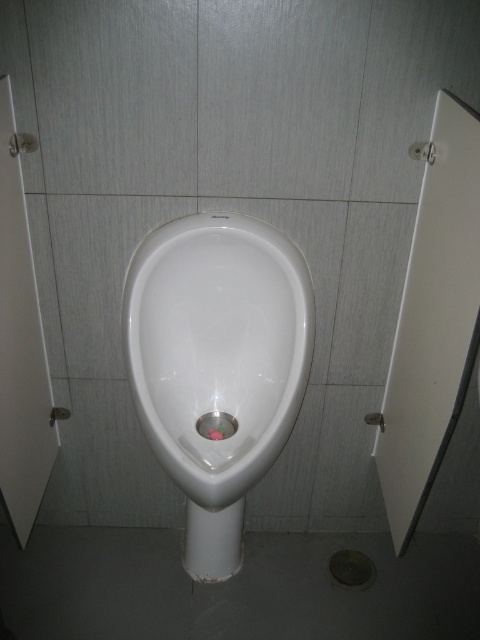
Who is more forward, (162, 326) or (352, 556)?

Positioned in front is point (162, 326).

Who is positioned more to the right, white glossy urinal at center or matte metallic drain at lower center?

Positioned to the right is matte metallic drain at lower center.

Does point (190, 282) come closer to viewer compared to point (348, 582)?

Yes.

Locate an element on the screen. The height and width of the screenshot is (640, 480). white glossy urinal at center is located at coordinates (217, 348).

Is matte metallic drain at lower center taller than metallic silver drain at center?

Yes.

This screenshot has width=480, height=640. Describe the element at coordinates (351, 568) in the screenshot. I see `matte metallic drain at lower center` at that location.

This screenshot has width=480, height=640. I want to click on matte metallic drain at lower center, so click(x=351, y=568).

Locate an element on the screen. This screenshot has height=640, width=480. white glossy urinal at center is located at coordinates (217, 348).

Between point (271, 404) and point (217, 428), which one is positioned in front?

Point (271, 404) is more forward.

Locate an element on the screen. The height and width of the screenshot is (640, 480). white glossy urinal at center is located at coordinates (217, 348).